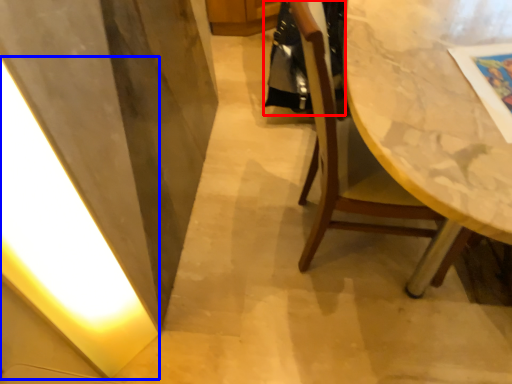
Question: Among these objects, which one is nearest to the camera, robe (highlighted by a red box) or light (highlighted by a blue box)?

Choices:
 (A) robe
 (B) light

Answer: (B)